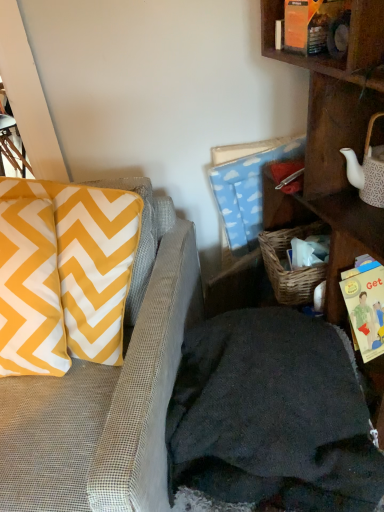
Question: From a real-world perspective, is yellow/white chevron pillow at left physically located above or below yellow paper book at right?

Choices:
 (A) above
 (B) below

Answer: (A)

Question: From their relative heights in the image, would you say yellow/white chevron pillow at left is taller or shorter than yellow paper book at right?

Choices:
 (A) tall
 (B) short

Answer: (A)

Question: Considering the real-world distances, which object is farthest from the yellow paper book at right?

Choices:
 (A) yellow/white chevron pillow at left
 (B) textured gray couch at left
 (C) wooden shelf at right

Answer: (A)

Question: Which is nearer to the yellow paper book at right?

Choices:
 (A) yellow/white chevron pillow at left
 (B) wooden shelf at right
 (C) textured gray couch at left

Answer: (B)